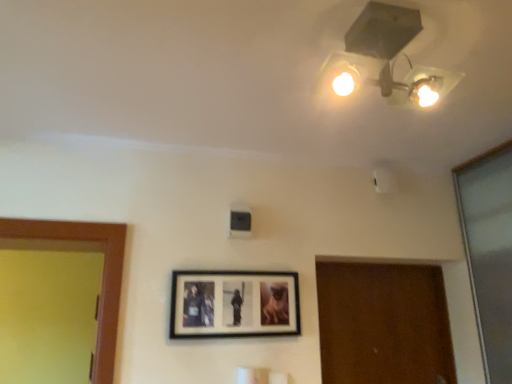
Question: Does matte white lamp at upper center lie behind wooden picture frame at center?

Choices:
 (A) no
 (B) yes

Answer: (A)

Question: From a real-world perspective, is matte white lamp at upper center located beneath wooden picture frame at center?

Choices:
 (A) no
 (B) yes

Answer: (A)

Question: Does matte white lamp at upper center have a larger size compared to wooden picture frame at center?

Choices:
 (A) yes
 (B) no

Answer: (A)

Question: Is matte white lamp at upper center shorter than wooden picture frame at center?

Choices:
 (A) yes
 (B) no

Answer: (A)

Question: Is matte white lamp at upper center thinner than wooden picture frame at center?

Choices:
 (A) yes
 (B) no

Answer: (B)

Question: Is matte white lamp at upper center taller than wooden picture frame at center?

Choices:
 (A) no
 (B) yes

Answer: (A)

Question: Does wooden picture frame at center turn towards matte white lamp at upper center?

Choices:
 (A) no
 (B) yes

Answer: (A)

Question: Can we say wooden picture frame at center lies outside matte white lamp at upper center?

Choices:
 (A) yes
 (B) no

Answer: (A)

Question: From the image's perspective, is wooden picture frame at center located above matte white lamp at upper center?

Choices:
 (A) no
 (B) yes

Answer: (A)

Question: Can you confirm if wooden picture frame at center is taller than matte white lamp at upper center?

Choices:
 (A) no
 (B) yes

Answer: (B)

Question: Can you confirm if wooden picture frame at center is thinner than matte white lamp at upper center?

Choices:
 (A) no
 (B) yes

Answer: (B)

Question: Does wooden picture frame at center have a larger size compared to matte white lamp at upper center?

Choices:
 (A) yes
 (B) no

Answer: (B)

Question: Visually, is matte white lamp at upper center positioned to the left or to the right of wooden picture frame at center?

Choices:
 (A) left
 (B) right

Answer: (B)